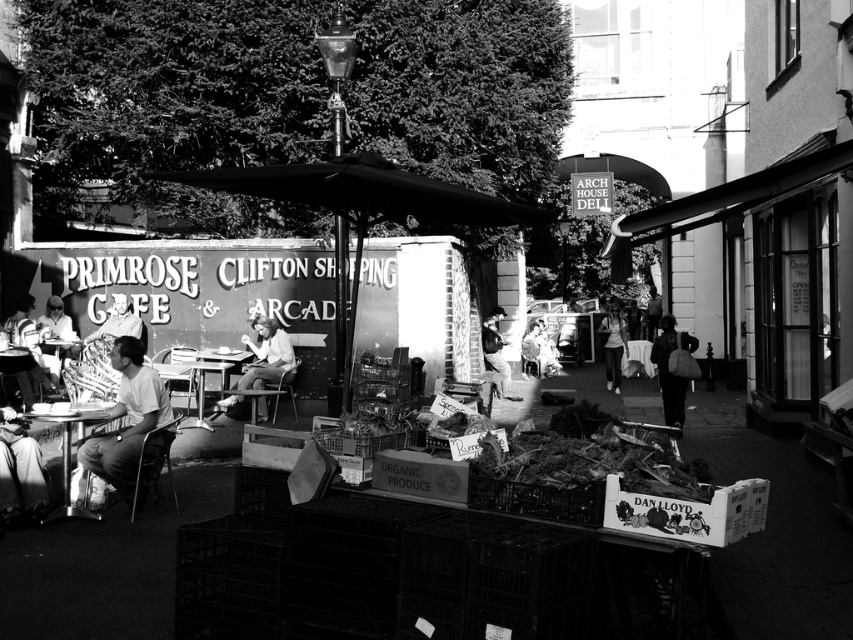
You are a delivery person who needs to place a package between the light brown fabric jacket at center and the light brown leather jacket at center. Is there enough space to fit the package, which is 10 feet long?

The light brown fabric jacket at center and the light brown leather jacket at center are 13.19 feet apart, so yes, the package which is 10 feet long can fit between them since the space is wider than the package.